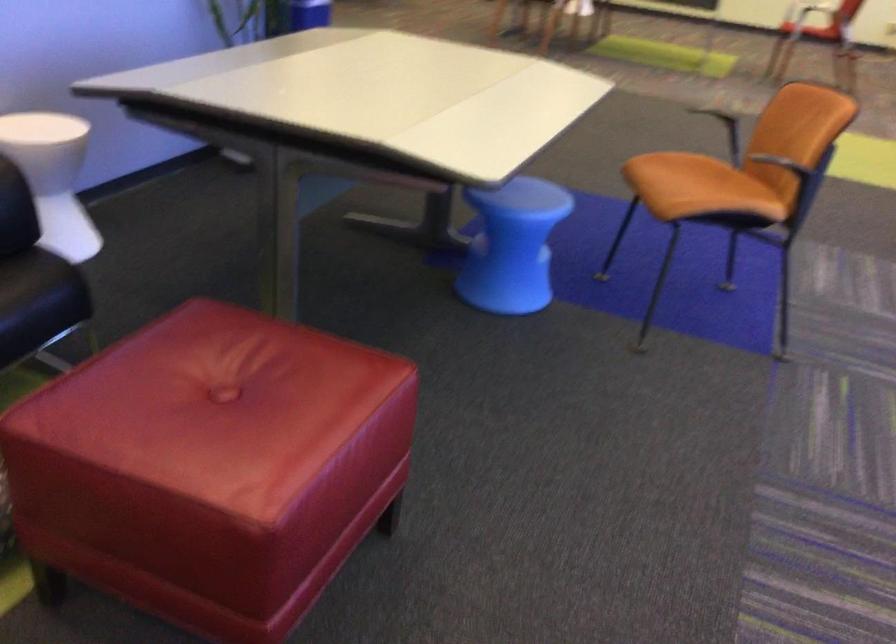
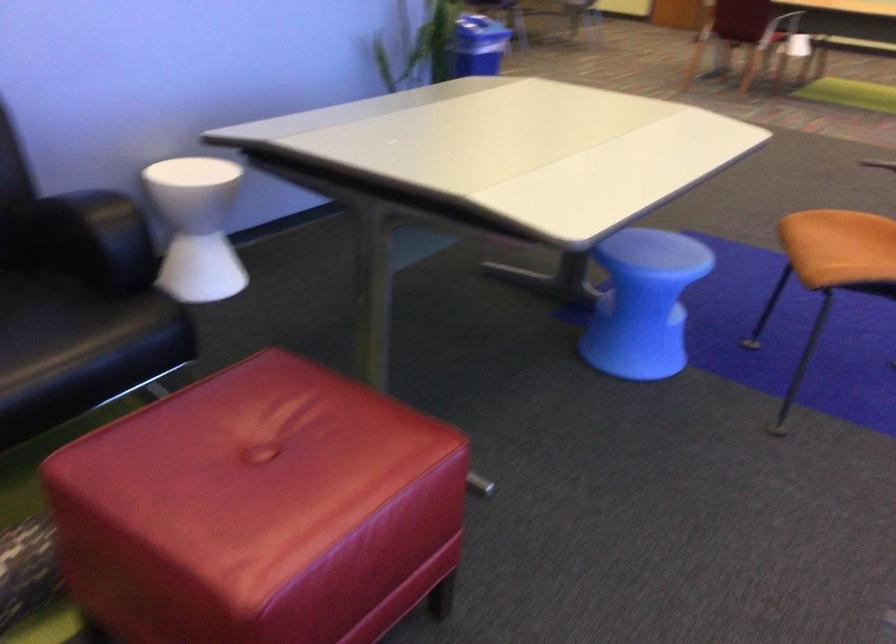
The images are taken continuously from a first-person perspective. In which direction are you moving?

The cameraman walked toward right, forward.